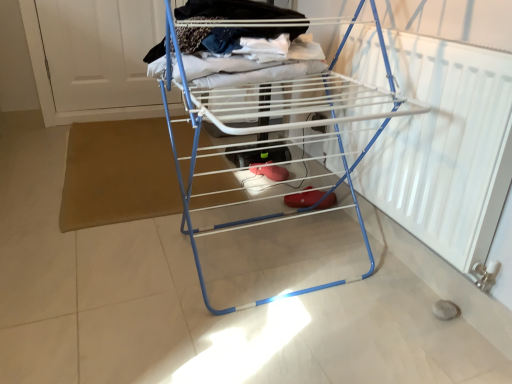
This screenshot has width=512, height=384. What are the coordinates of `free spot below blue metal drying rack at center (from a real-world perspective)` in the screenshot? It's located at (262, 254).